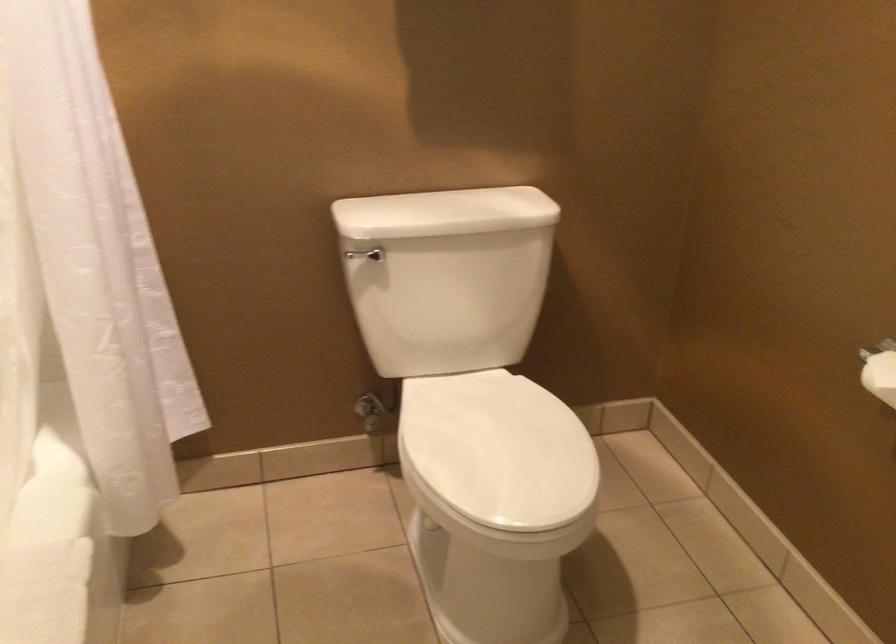
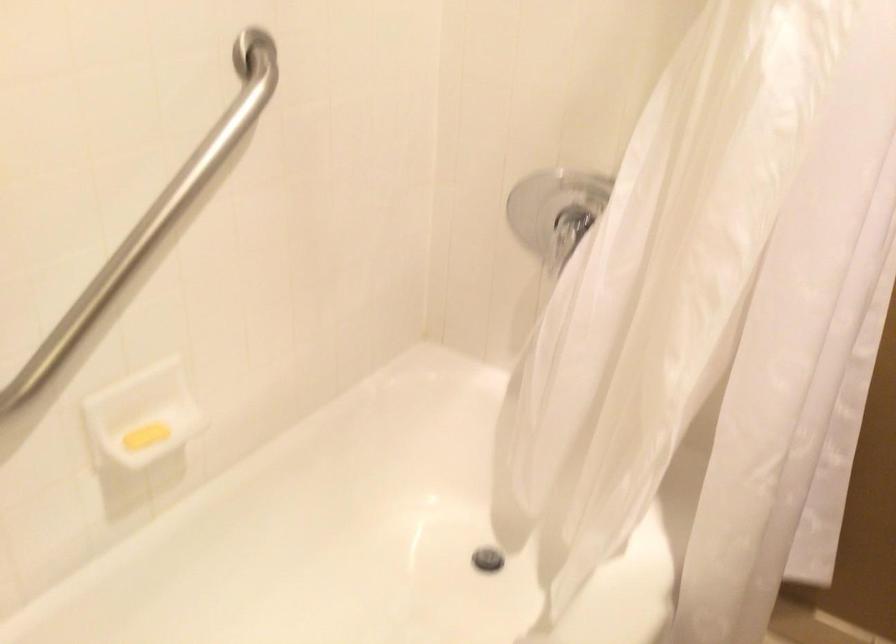
Question: The camera is either moving clockwise (left) or counter-clockwise (right) around the object. The first image is from the beginning of the video and the second image is from the end. Is the camera moving left or right when shooting the video?

Choices:
 (A) Left
 (B) Right

Answer: (B)